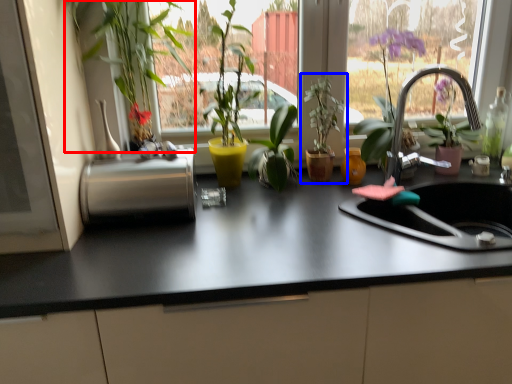
Question: Which object is closer to the camera taking this photo, houseplant (highlighted by a red box) or houseplant (highlighted by a blue box)?

Choices:
 (A) houseplant
 (B) houseplant

Answer: (A)